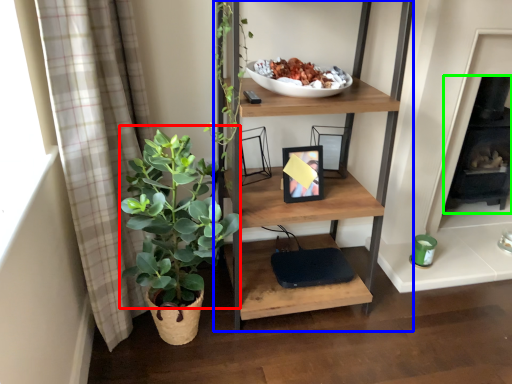
Question: Which is farther away from vegetation (highlighted by a red box)? shelf (highlighted by a blue box) or fireplace (highlighted by a green box)?

Choices:
 (A) shelf
 (B) fireplace

Answer: (B)